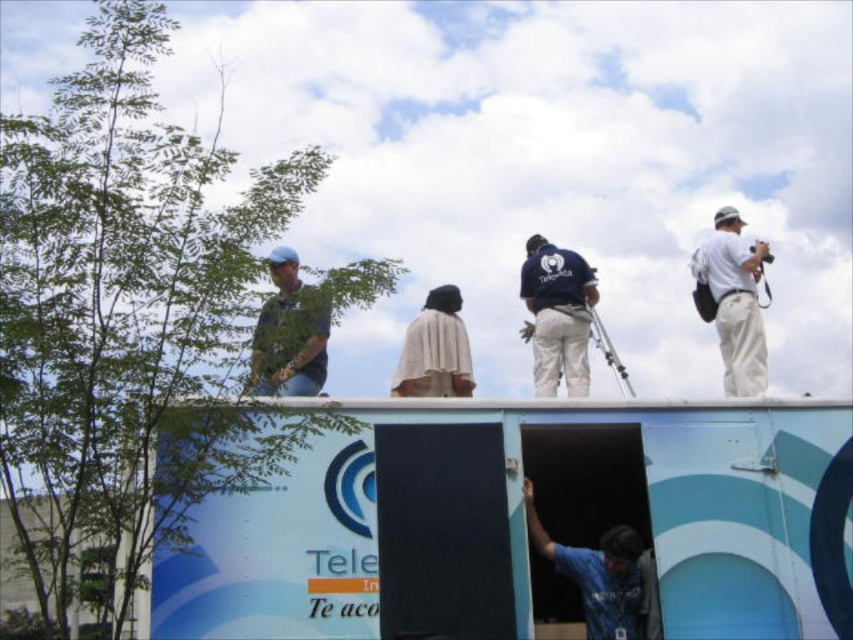
Is blue fabric shirt at lower center bigger than beige fabric shawl at center?

Actually, blue fabric shirt at lower center might be smaller than beige fabric shawl at center.

Between blue fabric shirt at lower center and beige fabric shawl at center, which one appears on the right side from the viewer's perspective?

blue fabric shirt at lower center is more to the right.

Who is more distant from viewer, [566,572] or [428,384]?

Positioned behind is point [428,384].

You are a GUI agent. You are given a task and a screenshot of the screen. Output one action in this format:
    pyautogui.click(x=<x>, y=<y>)
    Task: Click on the blue fabric shirt at lower center
    
    Given the screenshot: What is the action you would take?
    pyautogui.click(x=604, y=577)

Is white cotton shirt at upper right wider than blue denim jeans at left?

Yes, white cotton shirt at upper right is wider than blue denim jeans at left.

Can you confirm if white cotton shirt at upper right is taller than blue denim jeans at left?

Correct, white cotton shirt at upper right is much taller as blue denim jeans at left.

Who is more forward, (746,369) or (318,348)?

Point (318,348) is in front.

This screenshot has width=853, height=640. In order to click on white cotton shirt at upper right in this screenshot , I will do `click(734, 301)`.

Which is behind, point (323, 348) or point (468, 364)?

The point (323, 348) is behind.

How far apart are blue denim jeans at left and beige fabric shawl at center?

4.52 meters

Which is behind, point (276, 257) or point (445, 381)?

Point (276, 257)

The image size is (853, 640). I want to click on blue denim jeans at left, so 289,333.